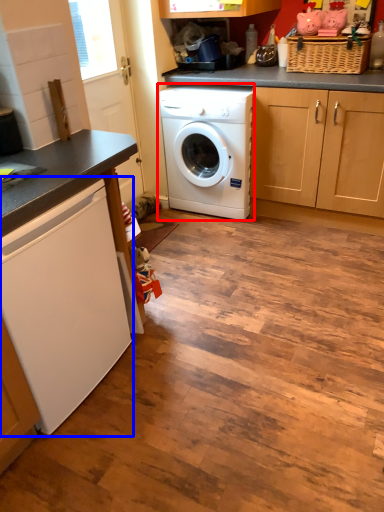
Question: Which of the following is the farthest to the observer, washing machine (highlighted by a red box) or washing machine (highlighted by a blue box)?

Choices:
 (A) washing machine
 (B) washing machine

Answer: (A)